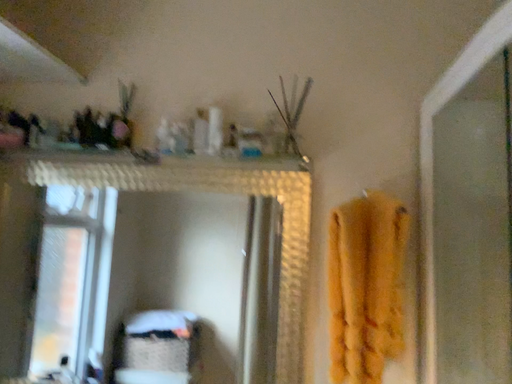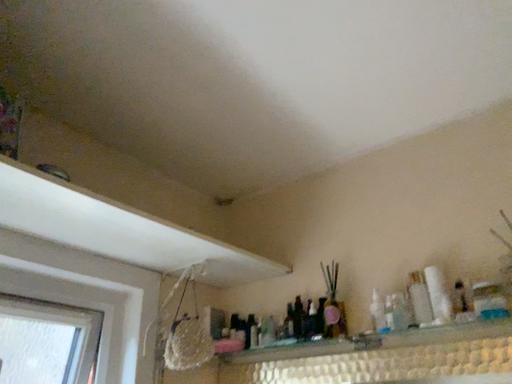
Question: How did the camera likely rotate when shooting the video?

Choices:
 (A) rotated left
 (B) rotated right

Answer: (A)